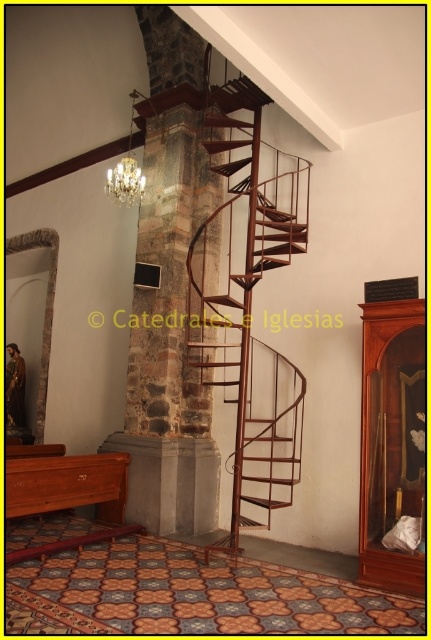
Question: Does rustic metal spiral staircase at center appear over crystal glass chandelier at upper center?

Choices:
 (A) yes
 (B) no

Answer: (B)

Question: Which object is farther from the camera taking this photo?

Choices:
 (A) rustic metal spiral staircase at center
 (B) gold metallic chandelier at upper center

Answer: (B)

Question: Is rustic metal spiral staircase at center closer to camera compared to crystal glass chandelier at upper center?

Choices:
 (A) no
 (B) yes

Answer: (B)

Question: Which object is farther from the camera taking this photo?

Choices:
 (A) crystal glass chandelier at upper center
 (B) gold metallic chandelier at upper center

Answer: (B)

Question: Which point is farther to the camera?

Choices:
 (A) gold metallic chandelier at upper center
 (B) crystal glass chandelier at upper center

Answer: (A)

Question: Is rustic metal spiral staircase at center below crystal glass chandelier at upper center?

Choices:
 (A) yes
 (B) no

Answer: (A)